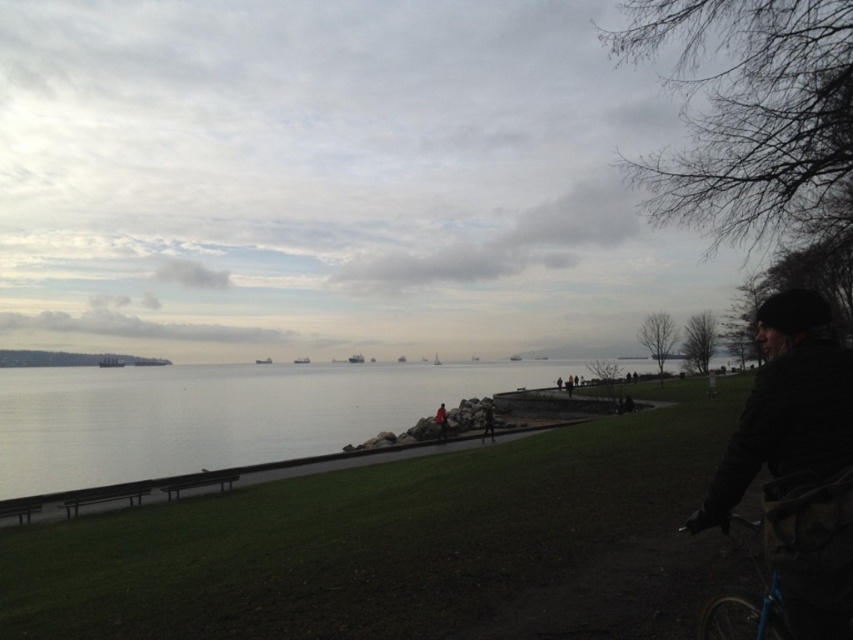
You are standing on the grassy area near the stone wall and see the dark woolen hat at right and the blue metallic bicycle at lower right. Which object is nearer to you?

The dark woolen hat at right is closer to the viewer than the blue metallic bicycle at lower right, so the dark woolen hat at right is nearer to you.

Looking at this image, you are a photographer trying to capture the cyclist and their bicycle in the scene. Since the dark woolen hat at right and the blue metallic bicycle at lower right are both in view, which object is located more to the right side?

The dark woolen hat at right is positioned on the right side of the blue metallic bicycle at lower right, so the dark woolen hat at right is more to the right side.

You are a photographer trying to capture the cyclist and their bicycle in the scene. Based on the position of the dark woolen hat at right and the blue metallic bicycle at lower right, which object is higher up in the image?

The dark woolen hat at right is above the blue metallic bicycle at lower right, so the dark woolen hat at right is higher up in the image.